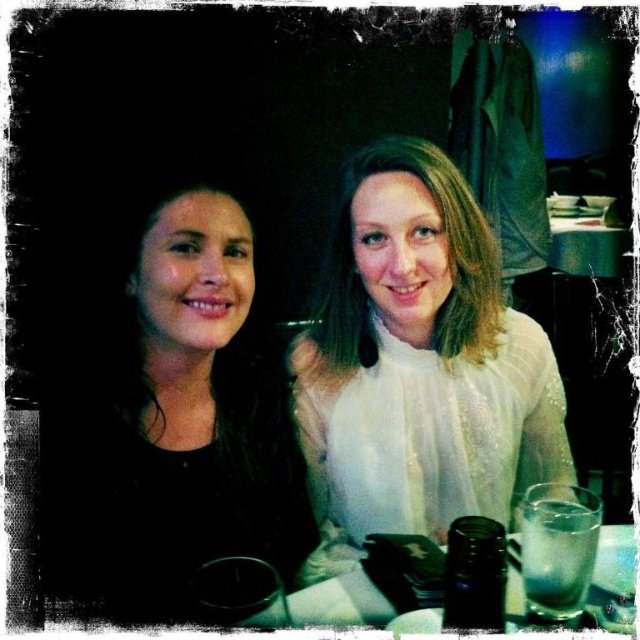
You are standing in front of the table where the two people are sitting. You want to place a new item exactly where the black matte hair at left is currently located. What coordinates should you use to place the item?

The coordinates for placing the new item should be at point (170, 412) where the black matte hair at left is located.

From the picture: You are a photographer standing behind the table in the image. You want to take a photo of the clear glass at right without the white lace blouse at center blocking the view. Is this possible?

The white lace blouse at center is further to the viewer than the clear glass at right, so it would block the view of the clear glass at right. Therefore, it is not possible to take a photo of the clear glass at right without the white lace blouse at center blocking the view.